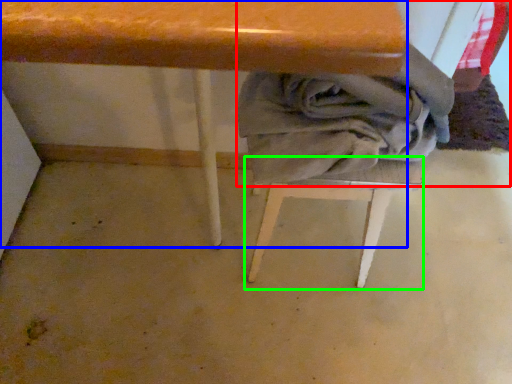
Question: Which object is positioned closest to laundry (highlighted by a red box)? Select from table (highlighted by a blue box) and step stool (highlighted by a green box).

Choices:
 (A) table
 (B) step stool

Answer: (B)